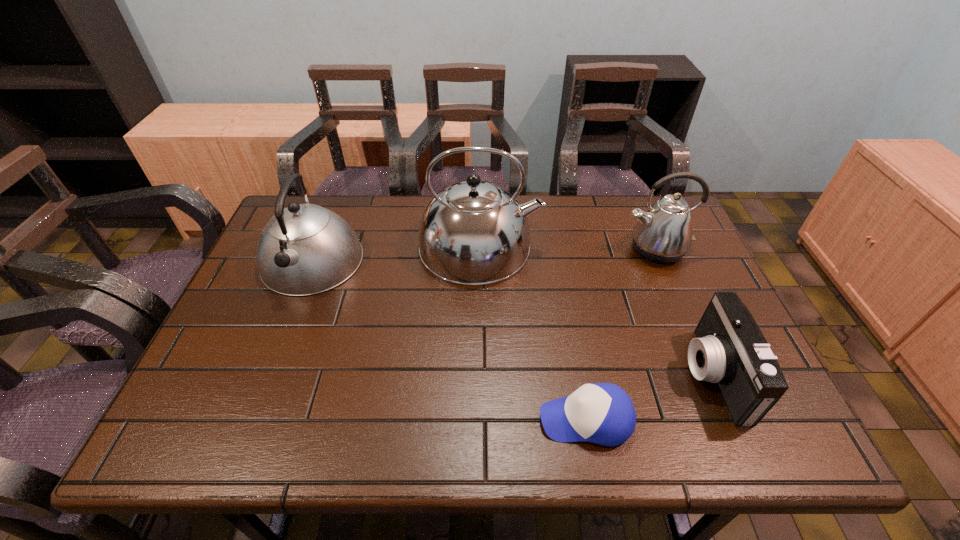
You are a GUI agent. You are given a task and a screenshot of the screen. Output one action in this format:
    pyautogui.click(x=<x>, y=<y>)
    Task: Click on the tallest kettle
    This screenshot has width=960, height=540.
    Given the screenshot: What is the action you would take?
    473,233

Identify the location of the second kettle from right to left. pos(473,233).

You are a GUI agent. You are given a task and a screenshot of the screen. Output one action in this format:
    pyautogui.click(x=<x>, y=<y>)
    Task: Click on the rightmost kettle
    The height and width of the screenshot is (540, 960).
    Given the screenshot: What is the action you would take?
    pyautogui.click(x=663, y=234)

This screenshot has width=960, height=540. Identify the location of the leftmost object. (305, 249).

This screenshot has height=540, width=960. In order to click on the fourth tallest object in this screenshot , I will do `click(730, 350)`.

Where is `the shortest object`? The width and height of the screenshot is (960, 540). the shortest object is located at coordinates (602, 413).

Find the location of a particular element. vacant space located 0.210m from the spout of the second kettle from left to right is located at coordinates (612, 246).

The height and width of the screenshot is (540, 960). I want to click on vacant space located 0.140m on the front of the rightmost kettle, so click(x=680, y=305).

Identify the location of vacant space located from the spout of the leftmost object. The width and height of the screenshot is (960, 540). (252, 414).

The height and width of the screenshot is (540, 960). What are the coordinates of `vacant space situated 0.220m on the lens of the fourth tallest object` in the screenshot? It's located at (590, 375).